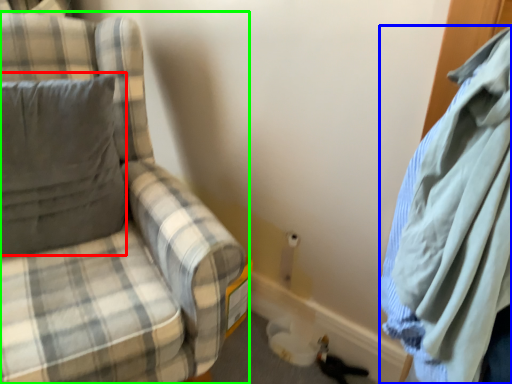
Question: Which is farther away from pillow (highlighted by a red box)? cloak (highlighted by a blue box) or chair (highlighted by a green box)?

Choices:
 (A) cloak
 (B) chair

Answer: (A)